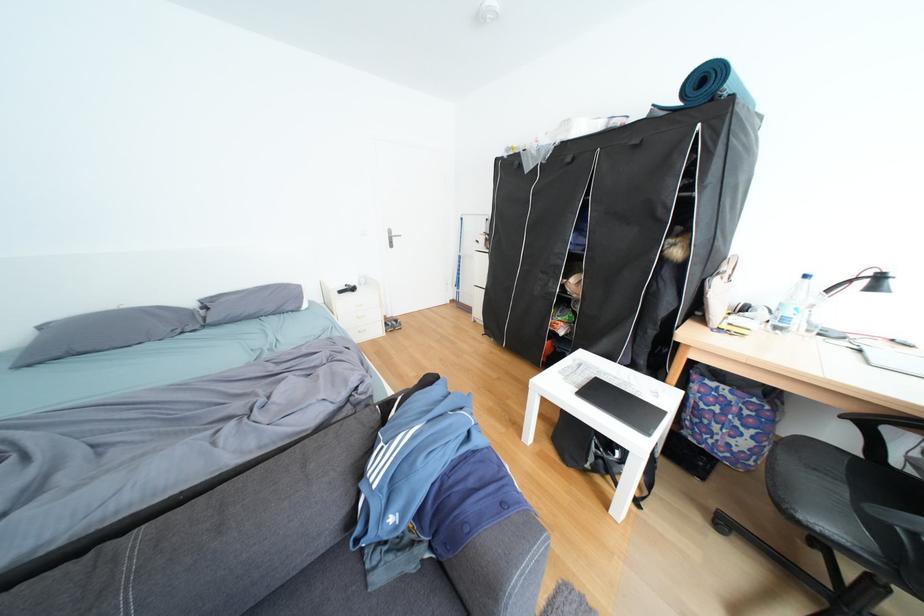
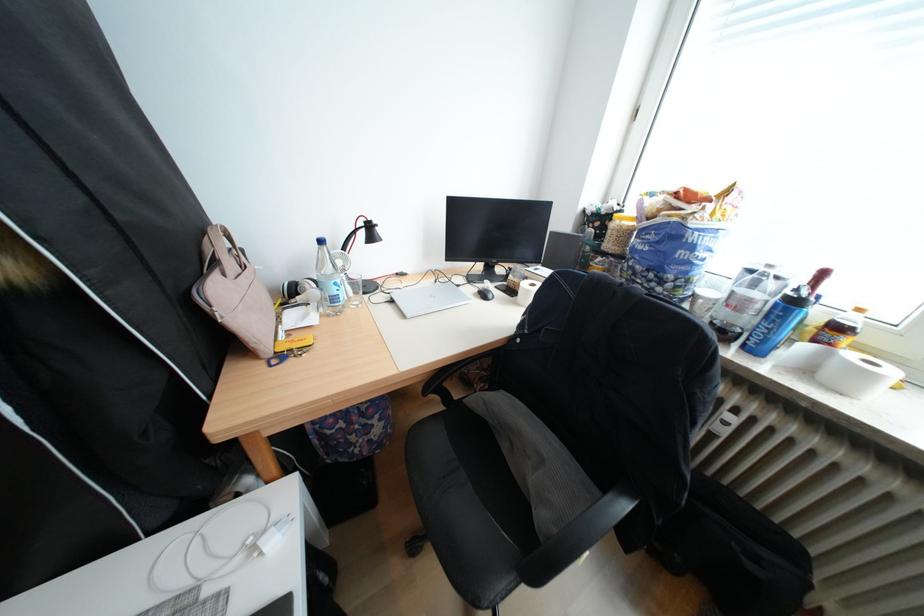
Based on the continuous images, in which direction is the camera rotating?

The camera's rotation is toward right-down.